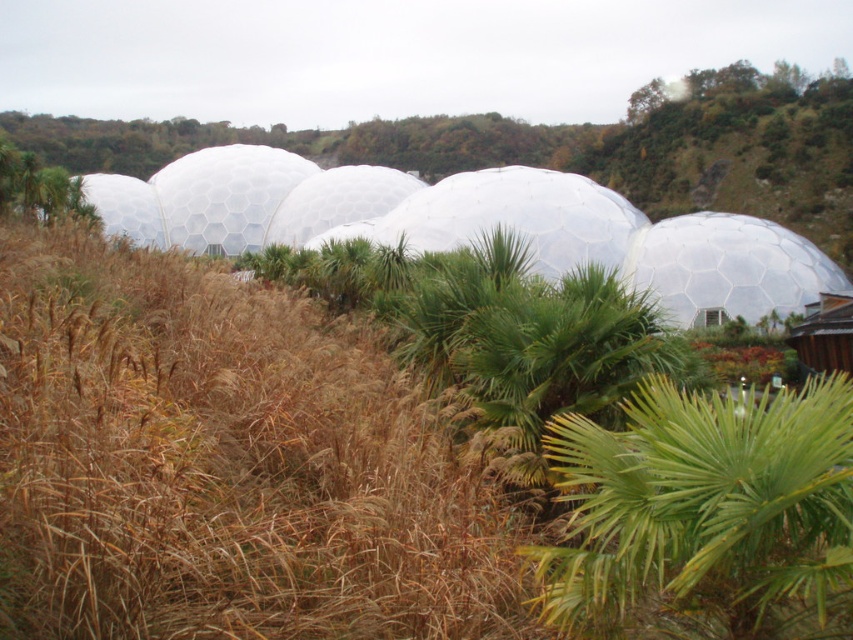
Is green leafy palm at center taller than transparent plastic dome at right?

No.

Is green leafy palm at center to the left of transparent plastic dome at right from the viewer's perspective?

Correct, you'll find green leafy palm at center to the left of transparent plastic dome at right.

Find the location of a particular element. Image resolution: width=853 pixels, height=640 pixels. green leafy palm at center is located at coordinates (706, 508).